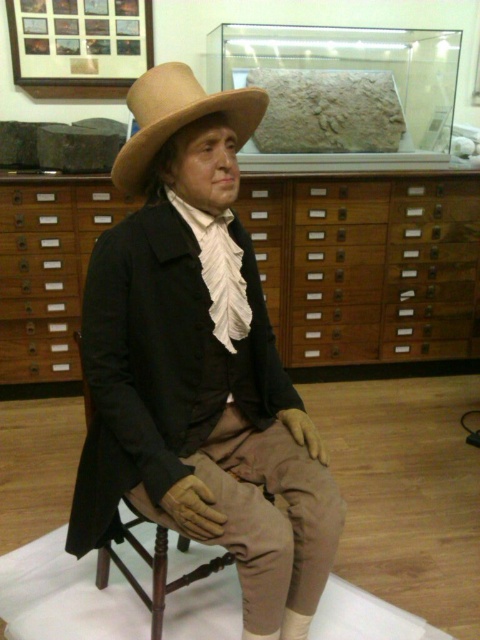
Question: From the image, what is the correct spatial relationship of matte brown hat at center in relation to wooden drawers at center?

Choices:
 (A) above
 (B) below

Answer: (B)

Question: Estimate the real-world distances between objects in this image. Which object is farther from the brown wooden chair at center?

Choices:
 (A) wooden drawers at center
 (B) light brown felt fedora at center

Answer: (A)

Question: Which is farther from the light brown felt fedora at center?

Choices:
 (A) matte brown hat at center
 (B) brown wooden chair at center
 (C) wooden drawers at center

Answer: (C)

Question: Is the position of matte brown hat at center more distant than that of brown wooden chair at center?

Choices:
 (A) yes
 (B) no

Answer: (B)

Question: Which object appears farthest from the camera in this image?

Choices:
 (A) wooden drawers at center
 (B) matte brown hat at center

Answer: (A)

Question: Is wooden drawers at center to the left of light brown felt fedora at center from the viewer's perspective?

Choices:
 (A) no
 (B) yes

Answer: (A)